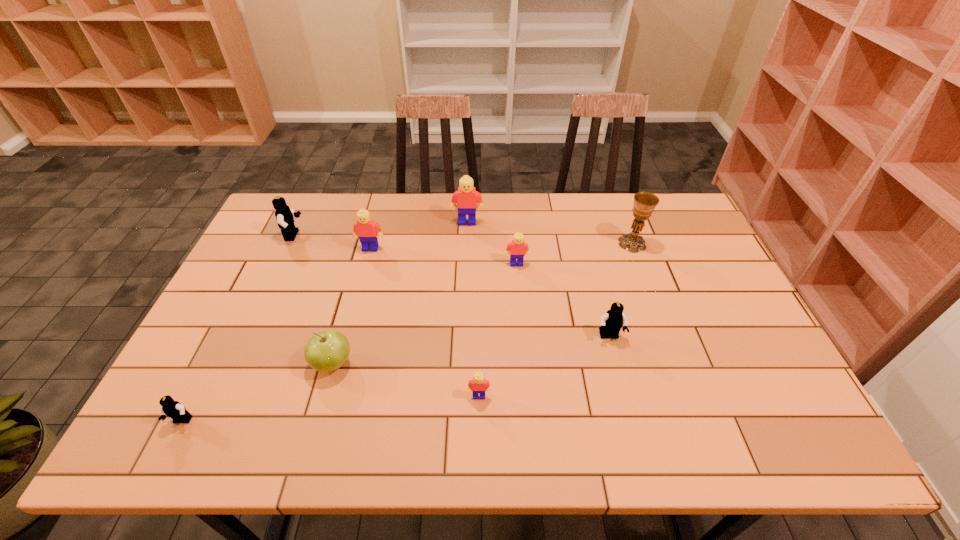
Locate an element on the screen. free region at the far edge of the desktop is located at coordinates (340, 207).

This screenshot has height=540, width=960. In order to click on free location at the left edge in this screenshot , I will do `click(243, 356)`.

Find the location of `free region at the right edge of the desktop`. free region at the right edge of the desktop is located at coordinates (722, 277).

In the image, there is a desktop. Where is `free region at the near left corner`? The image size is (960, 540). free region at the near left corner is located at coordinates (142, 447).

Find the location of a particular element. Image resolution: width=960 pixels, height=540 pixels. free space between the leftmost object and the second nearest Lego is located at coordinates (330, 409).

Identify the location of empty space that is in between the rightmost yellow Lego and the nearest object. The image size is (960, 540). (349, 342).

Find the location of `empty space that is in between the leftmost Lego and the leftmost yellow Lego`. empty space that is in between the leftmost Lego and the leftmost yellow Lego is located at coordinates (276, 335).

The image size is (960, 540). In order to click on vacant area between the green apple and the third nearest Lego in this screenshot , I will do `click(470, 350)`.

Find the location of `free point between the second nearest object and the rightmost Lego`. free point between the second nearest object and the rightmost Lego is located at coordinates (544, 366).

In order to click on vacant space that's between the second farthest black Lego and the second nearest object in this screenshot , I will do `click(544, 366)`.